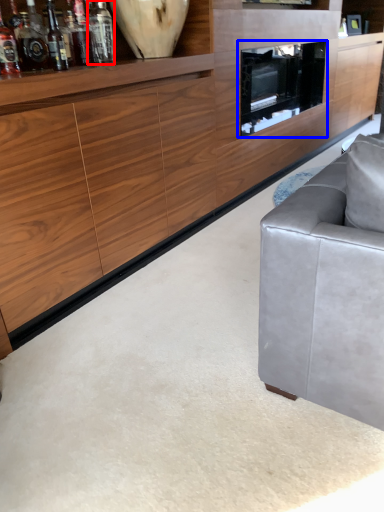
Question: Which object appears closest to the camera in this image, bottle (highlighted by a red box) or tv cabinet (highlighted by a blue box)?

Choices:
 (A) bottle
 (B) tv cabinet

Answer: (A)